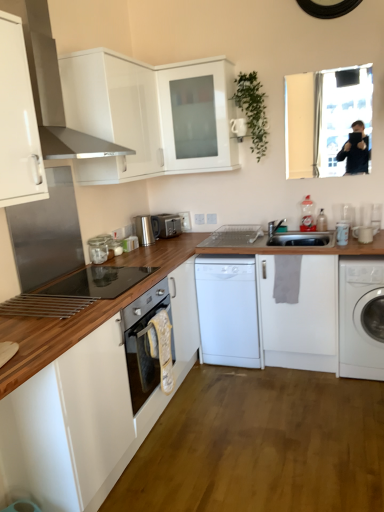
Question: Is satin silver toaster at center, the 1th kitchen appliance in the back-to-front sequence, looking in the opposite direction of white glossy cabinet at upper left, which ranks as the 3th cabinetry in bottom-to-top order?

Choices:
 (A) yes
 (B) no

Answer: (B)

Question: Does satin silver toaster at center, placed as the 1th kitchen appliance when sorted from top to bottom, have a greater height compared to white glossy cabinet at upper left, the third cabinetry when ordered from top to bottom?

Choices:
 (A) yes
 (B) no

Answer: (B)

Question: Considering the relative sizes of satin silver toaster at center, which is the first kitchen appliance from right to left, and white glossy cabinet at upper left, the third cabinetry when ordered from top to bottom, in the image provided, is satin silver toaster at center, which is the first kitchen appliance from right to left, smaller than white glossy cabinet at upper left, the third cabinetry when ordered from top to bottom,?

Choices:
 (A) yes
 (B) no

Answer: (A)

Question: Considering the relative sizes of satin silver toaster at center, which is counted as the second kitchen appliance, starting from the bottom, and white glossy cabinet at upper left, which ranks as the 3th cabinetry in bottom-to-top order, in the image provided, is satin silver toaster at center, which is counted as the second kitchen appliance, starting from the bottom, shorter than white glossy cabinet at upper left, which ranks as the 3th cabinetry in bottom-to-top order,?

Choices:
 (A) no
 (B) yes

Answer: (B)

Question: Is satin silver toaster at center, positioned as the second kitchen appliance in left-to-right order, wider than white glossy cabinet at upper left, which ranks as the 3th cabinetry in bottom-to-top order?

Choices:
 (A) no
 (B) yes

Answer: (A)

Question: Are satin silver toaster at center, positioned as the second kitchen appliance in left-to-right order, and white glossy cabinet at upper left, which ranks as the 3th cabinetry in bottom-to-top order, far apart?

Choices:
 (A) no
 (B) yes

Answer: (B)

Question: Is wooden countertop at center, the 1th cabinetry from the bottom, directly adjacent to white glossy mug at right, the 4th appliance when ordered from left to right?

Choices:
 (A) no
 (B) yes

Answer: (A)

Question: Does wooden countertop at center, the 1th cabinetry from the bottom, come in front of white glossy mug at right, which is the 1th appliance from front to back?

Choices:
 (A) yes
 (B) no

Answer: (A)

Question: Can you confirm if wooden countertop at center, which appears as the fifth cabinetry when viewed from the top, is smaller than white glossy mug at right, which is the 1th appliance from front to back?

Choices:
 (A) no
 (B) yes

Answer: (A)

Question: From a real-world perspective, is wooden countertop at center, the 1th cabinetry from the bottom, positioned under white glossy mug at right, the 4th appliance when ordered from left to right, based on gravity?

Choices:
 (A) yes
 (B) no

Answer: (A)

Question: From a real-world perspective, is wooden countertop at center, which appears as the fifth cabinetry when viewed from the top, on white glossy mug at right, which is the 1th appliance from front to back?

Choices:
 (A) no
 (B) yes

Answer: (A)

Question: From the image's perspective, would you say wooden countertop at center, the 1th cabinetry from the bottom, is shown under white glossy mug at right, which is the 1th appliance from front to back?

Choices:
 (A) yes
 (B) no

Answer: (A)

Question: Is white glossy mug at right, the 4th appliance positioned from the back, far from metallic stainless steel range hood at upper left?

Choices:
 (A) no
 (B) yes

Answer: (B)